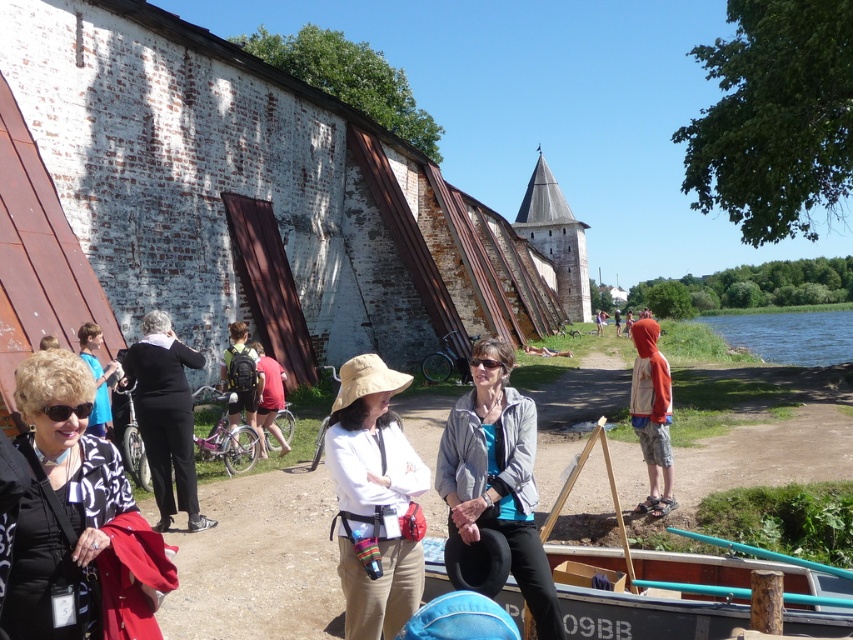
Does wooden boat at lower center have a lesser width compared to black matte pants at center?

In fact, wooden boat at lower center might be wider than black matte pants at center.

Can you confirm if wooden boat at lower center is positioned to the left of black matte pants at center?

Incorrect, wooden boat at lower center is not on the left side of black matte pants at center.

Is point (817, 612) more distant than point (155, 426)?

That is False.

At what (x,y) coordinates should I click in order to perform the action: click on wooden boat at lower center. Please return your answer as a coordinate pair (x, y). The height and width of the screenshot is (640, 853). Looking at the image, I should click on (647, 614).

Does black printed cardigan at lower left appear over matte black jacket at lower left?

Actually, black printed cardigan at lower left is below matte black jacket at lower left.

Who is positioned more to the right, black printed cardigan at lower left or matte black jacket at lower left?

black printed cardigan at lower left is more to the right.

You are a GUI agent. You are given a task and a screenshot of the screen. Output one action in this format:
    pyautogui.click(x=<x>, y=<y>)
    Task: Click on the black printed cardigan at lower left
    
    Given the screenshot: What is the action you would take?
    pyautogui.click(x=74, y=522)

At what (x,y) coordinates should I click in order to perform the action: click on black printed cardigan at lower left. Please return your answer as a coordinate pair (x, y). Looking at the image, I should click on (74, 522).

Can you confirm if black matte pants at center is thinner than matte black jacket at lower left?

Yes.

Can you confirm if black matte pants at center is positioned above matte black jacket at lower left?

No.

Is point (146, 381) less distant than point (97, 429)?

Yes, it is.

Where is `black matte pants at center`? black matte pants at center is located at coordinates (165, 416).